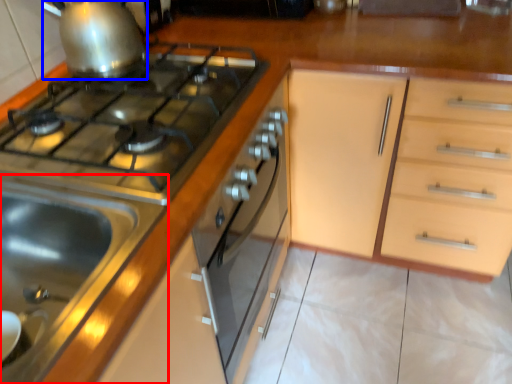
Question: Which of the following is the farthest to the observer, sink (highlighted by a red box) or kitchen appliance (highlighted by a blue box)?

Choices:
 (A) sink
 (B) kitchen appliance

Answer: (B)